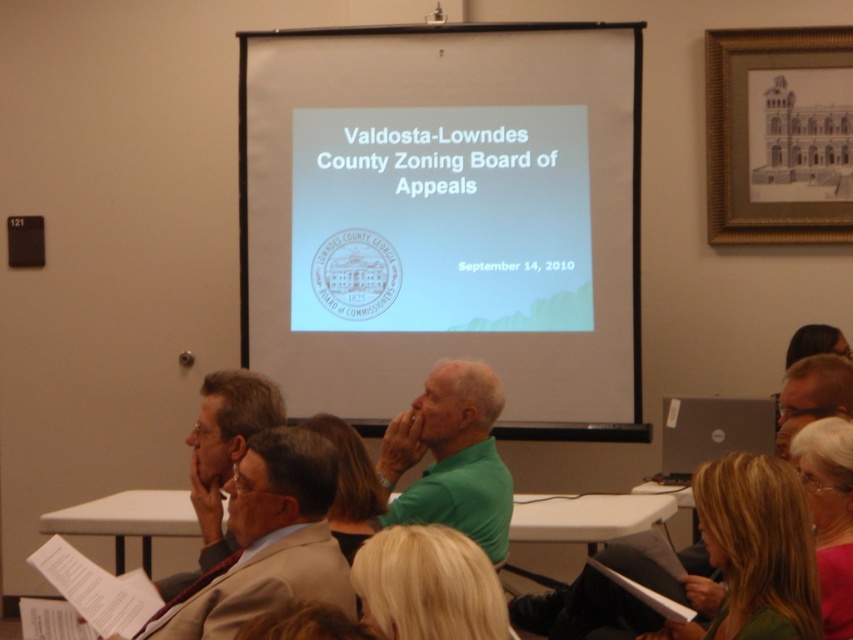
Is green matte shirt at lower right positioned behind pink fabric at lower right?

No, it is not.

This screenshot has width=853, height=640. Find the location of `green matte shirt at lower right`. green matte shirt at lower right is located at coordinates (755, 552).

Between point (772, 509) and point (810, 506), which one is positioned in front?

Point (772, 509) is in front.

Where is `green matte shirt at lower right`? This screenshot has width=853, height=640. green matte shirt at lower right is located at coordinates (755, 552).

Does light brown suit at center lie behind blonde hair at center?

Yes, light brown suit at center is further from the viewer.

In the scene shown: Which is more to the left, light brown suit at center or blonde hair at center?

light brown suit at center is more to the left.

Image resolution: width=853 pixels, height=640 pixels. In order to click on light brown suit at center in this screenshot , I will do `click(270, 540)`.

Consider the image. Is gold-framed drawing at upper right smaller than pink fabric at lower right?

Actually, gold-framed drawing at upper right might be larger than pink fabric at lower right.

The width and height of the screenshot is (853, 640). What do you see at coordinates (730, 132) in the screenshot?
I see `gold-framed drawing at upper right` at bounding box center [730, 132].

This screenshot has height=640, width=853. In order to click on gold-framed drawing at upper right in this screenshot , I will do [730, 132].